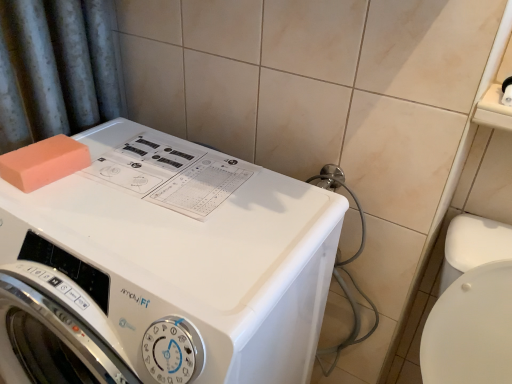
The image size is (512, 384). Describe the element at coordinates (42, 162) in the screenshot. I see `orange matte sponge at top left` at that location.

This screenshot has width=512, height=384. Find the location of `orange matte sponge at top left`. orange matte sponge at top left is located at coordinates (42, 162).

In order to face white glossy washing machine at center, should I rotate leftwards or rightwards?

A 9.909 degree turn to the left will do.

The width and height of the screenshot is (512, 384). Describe the element at coordinates (164, 267) in the screenshot. I see `white glossy washing machine at center` at that location.

The image size is (512, 384). Find the location of `white glossy washing machine at center`. white glossy washing machine at center is located at coordinates (164, 267).

Identify the location of orange matte sponge at top left. This screenshot has width=512, height=384. tap(42, 162).

Which object is positioned more to the left, orange matte sponge at top left or white glossy washing machine at center?

orange matte sponge at top left is more to the left.

Which is in front, orange matte sponge at top left or white glossy washing machine at center?

white glossy washing machine at center.

Which is in front, point (82, 167) or point (264, 281)?

The point (264, 281) is in front.

From the image's perspective, would you say orange matte sponge at top left is shown under white glossy washing machine at center?

No.

From a real-world perspective, which is physically above, orange matte sponge at top left or white glossy washing machine at center?

From a 3D spatial view, orange matte sponge at top left is above.

Between orange matte sponge at top left and white glossy washing machine at center, which one has larger width?

white glossy washing machine at center is wider.

Considering the sizes of objects orange matte sponge at top left and white glossy washing machine at center in the image provided, who is shorter, orange matte sponge at top left or white glossy washing machine at center?

orange matte sponge at top left is shorter.

Between orange matte sponge at top left and white glossy washing machine at center, which one has smaller size?

Smaller between the two is orange matte sponge at top left.

Is orange matte sponge at top left inside the boundaries of white glossy washing machine at center, or outside?

orange matte sponge at top left is spatially positioned inside white glossy washing machine at center.

Can you see orange matte sponge at top left touching white glossy washing machine at center?

No.

Does orange matte sponge at top left turn towards white glossy washing machine at center?

No, orange matte sponge at top left does not turn towards white glossy washing machine at center.

How different are the orientations of orange matte sponge at top left and white glossy washing machine at center in degrees?

There is a 4.3-degree angle between the facing directions of orange matte sponge at top left and white glossy washing machine at center.

Identify the location of soap behind the white glossy washing machine at center. The image size is (512, 384). (42, 162).

Is white glossy washing machine at center to the left of orange matte sponge at top left from the viewer's perspective?

Incorrect, white glossy washing machine at center is not on the left side of orange matte sponge at top left.

Which object is closer to the camera, white glossy washing machine at center or orange matte sponge at top left?

white glossy washing machine at center is more forward.

Which point is more forward, (104, 201) or (80, 164)?

The point (104, 201) is closer.

From the image's perspective, between white glossy washing machine at center and orange matte sponge at top left, who is located below?

white glossy washing machine at center is shown below in the image.

Based on the photo, from a real-world perspective, which is physically below, white glossy washing machine at center or orange matte sponge at top left?

white glossy washing machine at center, from a real-world perspective.

Can you confirm if white glossy washing machine at center is thinner than orange matte sponge at top left?

Incorrect, the width of white glossy washing machine at center is not less than that of orange matte sponge at top left.

Is white glossy washing machine at center shorter than orange matte sponge at top left?

Incorrect, the height of white glossy washing machine at center does not fall short of that of orange matte sponge at top left.

Is white glossy washing machine at center smaller than orange matte sponge at top left?

Actually, white glossy washing machine at center might be larger than orange matte sponge at top left.

Is white glossy washing machine at center spatially inside orange matte sponge at top left, or outside of it?

white glossy washing machine at center exists outside the volume of orange matte sponge at top left.

Is white glossy washing machine at center positioned far away from orange matte sponge at top left?

No, white glossy washing machine at center is not far away from orange matte sponge at top left.

Looking at this image, is white glossy washing machine at center looking in the opposite direction of orange matte sponge at top left?

white glossy washing machine at center does not have its back to orange matte sponge at top left.

How many degrees apart are the facing directions of white glossy washing machine at center and orange matte sponge at top left?

The facing directions of white glossy washing machine at center and orange matte sponge at top left are 4.3 degrees apart.

Based on the photo, measure the distance between white glossy washing machine at center and orange matte sponge at top left.

white glossy washing machine at center is 10.76 inches from orange matte sponge at top left.

At what (x,y) coordinates should I click in order to perform the action: click on soap lying above the white glossy washing machine at center (from the image's perspective). Please return your answer as a coordinate pair (x, y). Looking at the image, I should click on (42, 162).

Where is `soap that is on the left side of white glossy washing machine at center`? soap that is on the left side of white glossy washing machine at center is located at coordinates (42, 162).

This screenshot has width=512, height=384. What are the coordinates of `soap located above the white glossy washing machine at center (from a real-world perspective)` in the screenshot? It's located at (42, 162).